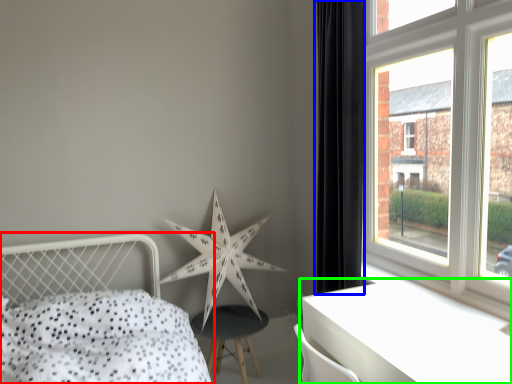
Question: Estimate the real-world distances between objects in this image. Which object is closer to bed (highlighted by a red box), curtain (highlighted by a blue box) or table (highlighted by a green box)?

Choices:
 (A) curtain
 (B) table

Answer: (B)